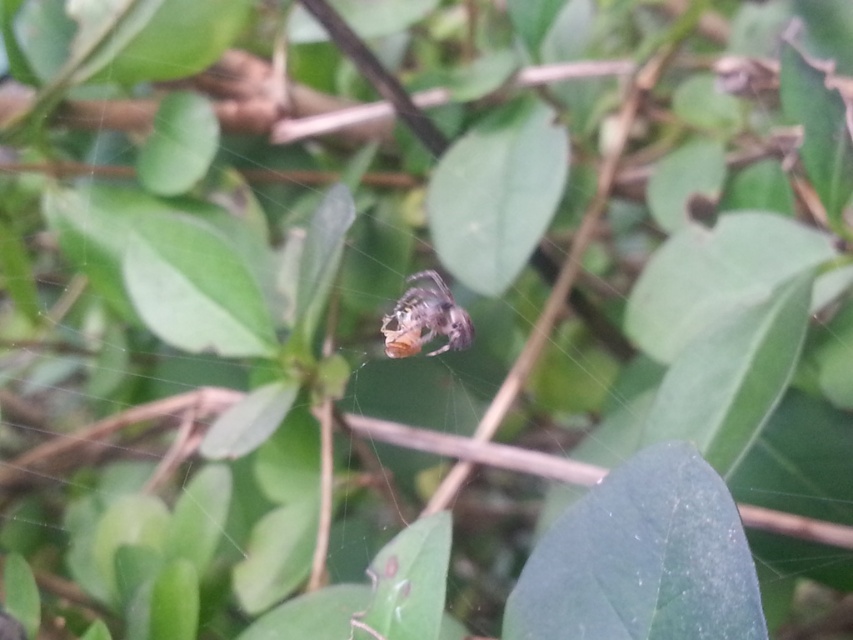
Between green matte leaf at center and shiny metallic spider at center, which one appears on the left side from the viewer's perspective?

From the viewer's perspective, shiny metallic spider at center appears more on the left side.

Can you confirm if green matte leaf at center is positioned below shiny metallic spider at center?

Yes, green matte leaf at center is below shiny metallic spider at center.

This screenshot has height=640, width=853. Identify the location of green matte leaf at center. (642, 560).